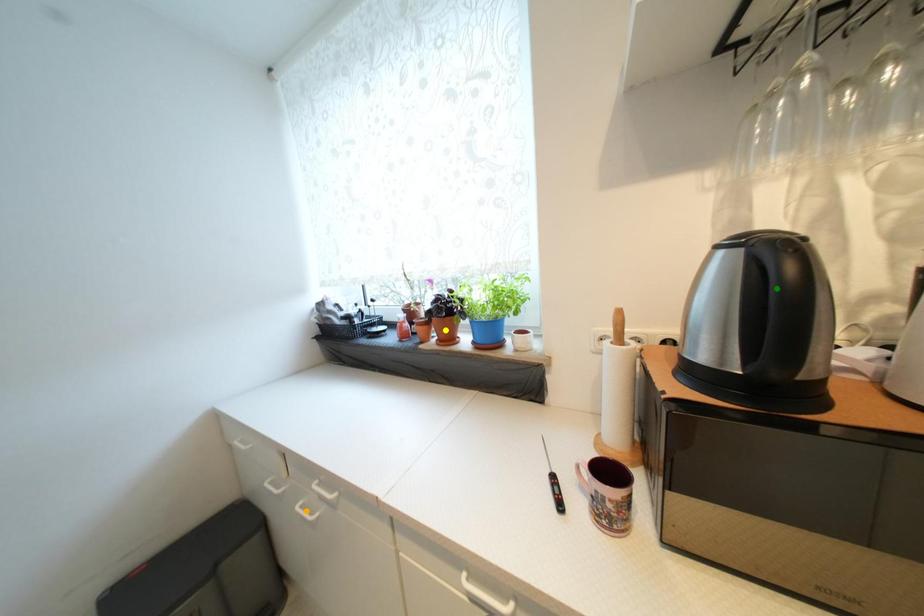
Order these from nearest to farthest:
1. orange point
2. yellow point
3. green point

yellow point
orange point
green point